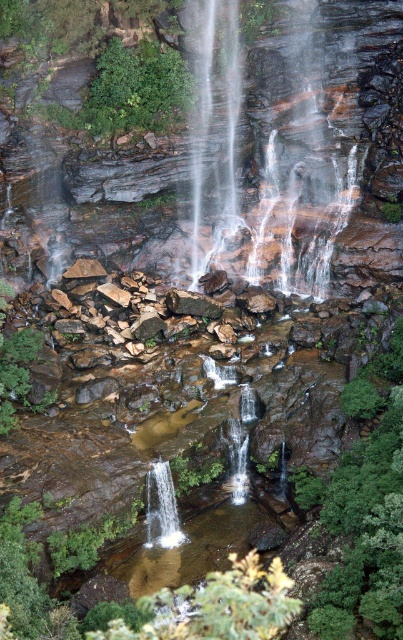
Question: Which object is farther from the camera taking this photo?

Choices:
 (A) white smooth waterfall at center
 (B) clear water at center

Answer: (B)

Question: Which point appears closest to the camera in this image?

Choices:
 (A) (243, 228)
 (B) (172, 492)

Answer: (B)

Question: Is clear water at center above white smooth waterfall at center?

Choices:
 (A) yes
 (B) no

Answer: (A)

Question: Can you confirm if clear water at center is bigger than white smooth waterfall at center?

Choices:
 (A) no
 (B) yes

Answer: (A)

Question: Is clear water at center to the right of white smooth waterfall at center from the viewer's perspective?

Choices:
 (A) no
 (B) yes

Answer: (B)